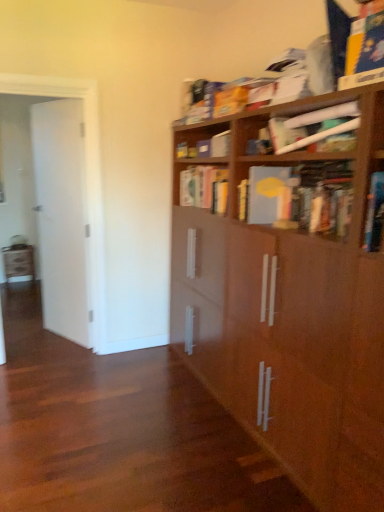
Question: Which direction should I rotate to face yellow matte book at center, the first book in the back-to-front sequence, — up or down?

Choices:
 (A) down
 (B) up

Answer: (B)

Question: Does brown wood bookcase at upper right have a lesser height compared to matte gray book at upper right, arranged as the 2th book when viewed from the back?

Choices:
 (A) no
 (B) yes

Answer: (A)

Question: Is matte gray book at upper right, arranged as the 2th book when viewed from the back, at the back of brown wood bookcase at upper right?

Choices:
 (A) no
 (B) yes

Answer: (B)

Question: Would you say brown wood bookcase at upper right is outside matte gray book at upper right, acting as the second book starting from the front?

Choices:
 (A) no
 (B) yes

Answer: (B)

Question: Is brown wood bookcase at upper right not near matte gray book at upper right, arranged as the 2th book when viewed from the back?

Choices:
 (A) yes
 (B) no

Answer: (B)

Question: Is the depth of brown wood bookcase at upper right greater than that of matte gray book at upper right, acting as the second book starting from the front?

Choices:
 (A) no
 (B) yes

Answer: (A)

Question: Can you confirm if brown wood bookcase at upper right is bigger than matte gray book at upper right, arranged as the 2th book when viewed from the back?

Choices:
 (A) no
 (B) yes

Answer: (B)

Question: Is matte gray book at upper right, acting as the second book starting from the front, closer to the viewer compared to yellow matte book at center, which is counted as the 3th book, starting from the front?

Choices:
 (A) no
 (B) yes

Answer: (B)

Question: Does matte gray book at upper right, arranged as the 2th book when viewed from the back, contain yellow matte book at center, the first book in the back-to-front sequence?

Choices:
 (A) no
 (B) yes

Answer: (A)

Question: Is matte gray book at upper right, acting as the second book starting from the front, at the right side of yellow matte book at center, the first book in the back-to-front sequence?

Choices:
 (A) yes
 (B) no

Answer: (A)

Question: Is matte gray book at upper right, acting as the second book starting from the front, turned away from yellow matte book at center, which is counted as the 3th book, starting from the front?

Choices:
 (A) yes
 (B) no

Answer: (B)

Question: From a real-world perspective, is matte gray book at upper right, arranged as the 2th book when viewed from the back, positioned over yellow matte book at center, the first book in the back-to-front sequence, based on gravity?

Choices:
 (A) no
 (B) yes

Answer: (B)

Question: Can you confirm if matte gray book at upper right, arranged as the 2th book when viewed from the back, is taller than yellow matte book at center, the first book in the back-to-front sequence?

Choices:
 (A) yes
 (B) no

Answer: (B)

Question: Considering the relative sizes of white glossy door at left and yellow matte book at center, which is counted as the 3th book, starting from the front, in the image provided, is white glossy door at left bigger than yellow matte book at center, which is counted as the 3th book, starting from the front,?

Choices:
 (A) no
 (B) yes

Answer: (B)